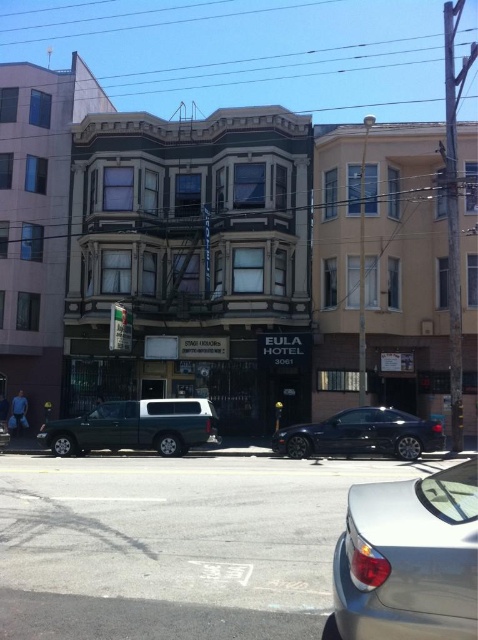
Consider the image. You are a delivery person needing to park your van between the satin silver sedan at lower right and the shiny dark blue car at center. The van is 20 feet long. Can you fit it in the space between them?

The satin silver sedan at lower right and the shiny dark blue car at center are 45.76 feet apart. Since the van is 20 feet long, there is sufficient space to park it between them as the distance between the two cars is more than double the van length.

You are standing at the point with coordinates point (414, 492) and want to walk to the point with coordinates point (173, 515). Which direction should you move relative to the point you are currently at?

You should move forward because point (173, 515) is behind point (414, 492), meaning it is in the direction you are facing when standing at point (414, 492).

You are a delivery person trying to park your truck, which is 2 meters tall, in this street. There are two cars present. Based on the scene, can you determine if your truck can pass between the satin silver sedan at lower right and the shiny dark blue car at center without hitting the top?

The satin silver sedan at lower right has a lesser height compared to shiny dark blue car at center. Since the shiny dark blue car at center is taller, the truck might not be able to pass if the height clearance is determined by the taller vehicle. However, the exact height of the shiny dark blue car is not provided, so it is uncertain whether the truck can pass safely.